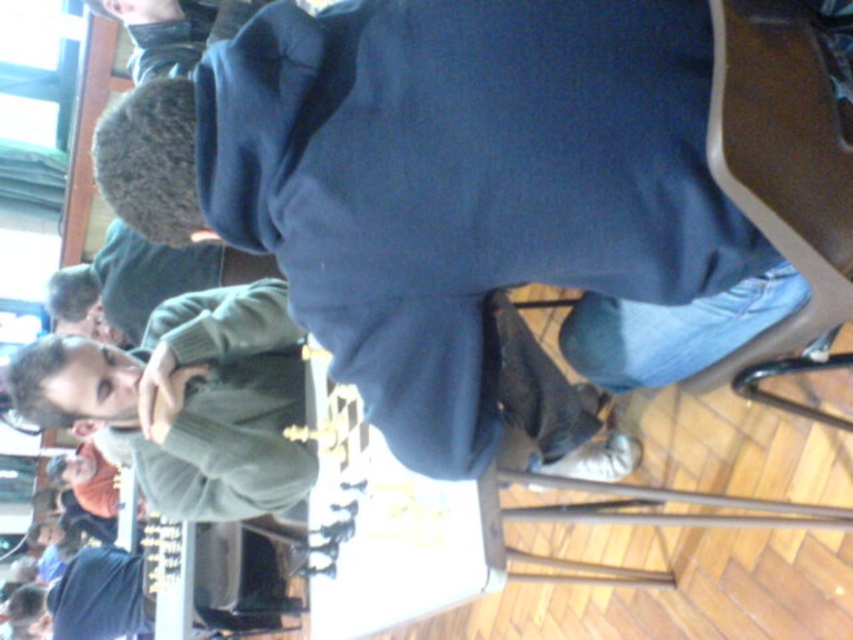
Question: Does dark blue sweatshirt at center have a smaller size compared to brown fabric chair at lower right?

Choices:
 (A) yes
 (B) no

Answer: (A)

Question: Can you confirm if dark blue sweatshirt at center is smaller than brown fabric chair at lower right?

Choices:
 (A) no
 (B) yes

Answer: (B)

Question: Among these points, which one is farthest from the camera?

Choices:
 (A) (421, 209)
 (B) (830, 92)

Answer: (A)

Question: Which object appears closest to the camera in this image?

Choices:
 (A) brown fabric chair at lower right
 (B) dark blue sweatshirt at center

Answer: (A)

Question: Can you confirm if dark blue sweatshirt at center is bigger than brown fabric chair at lower right?

Choices:
 (A) no
 (B) yes

Answer: (A)